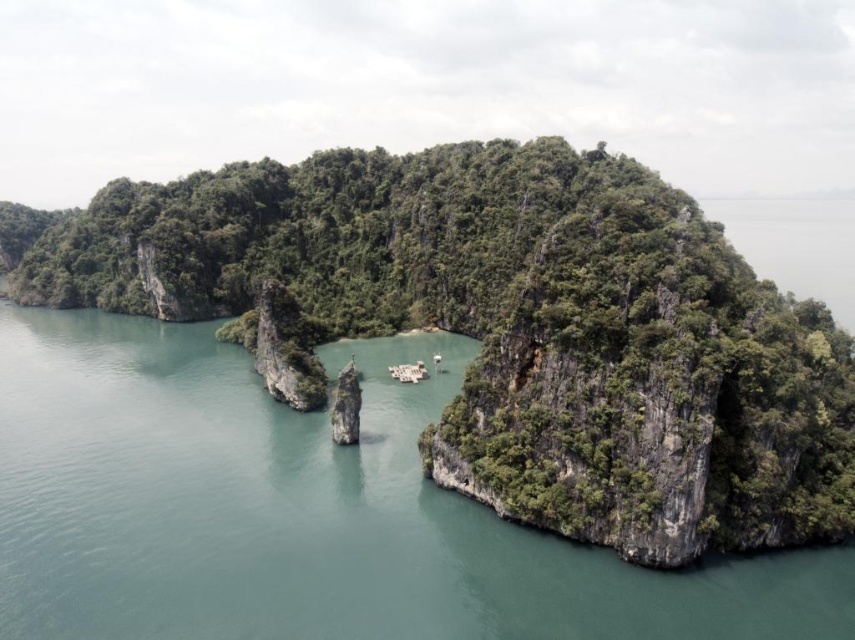
You are a hiker who has just arrived at the coast and wants to take a photo of the green leafy vegetation at center. Where should you position yourself to capture it in the frame?

You should position yourself at point (x=504, y=326) to capture the green leafy vegetation at center in the frame.

You are a hiker who wants to reach the smooth gray rock at center on the island. You are currently standing on the green leafy vegetation at center. Which direction should you move to reach the rock?

The green leafy vegetation at center is to the left of smooth gray rock at center, so you should move to the right to reach the rock.

You are standing on the floating platform at the center of the island and want to place a tall potted plant. The potted plant must be placed on either the green leafy vegetation at center or the smooth gray rock at center. Which location allows the potted plant to grow taller without obstruction?

The green leafy vegetation at center has a greater height compared to the smooth gray rock at center, so placing the potted plant there would allow it to grow taller without obstruction.